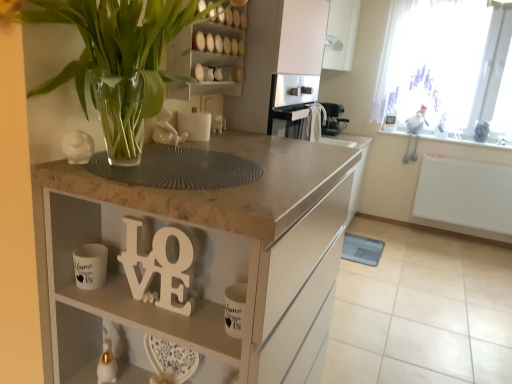
Question: Can you confirm if white matte cabinet at upper center is taller than clear glass vase at upper left?

Choices:
 (A) no
 (B) yes

Answer: (B)

Question: Is white matte cabinet at upper center oriented away from clear glass vase at upper left?

Choices:
 (A) yes
 (B) no

Answer: (B)

Question: Can you confirm if white matte cabinet at upper center is positioned to the right of clear glass vase at upper left?

Choices:
 (A) yes
 (B) no

Answer: (A)

Question: Is white matte cabinet at upper center shorter than clear glass vase at upper left?

Choices:
 (A) yes
 (B) no

Answer: (B)

Question: From a real-world perspective, is white matte cabinet at upper center below clear glass vase at upper left?

Choices:
 (A) yes
 (B) no

Answer: (B)

Question: Is the position of white matte cabinet at upper center more distant than that of clear glass vase at upper left?

Choices:
 (A) no
 (B) yes

Answer: (B)

Question: Does white matte wooden letters at center have a greater height compared to white sheer curtain at upper right?

Choices:
 (A) yes
 (B) no

Answer: (B)

Question: Is white matte wooden letters at center at the right side of white sheer curtain at upper right?

Choices:
 (A) yes
 (B) no

Answer: (B)

Question: Can we say white matte wooden letters at center lies outside white sheer curtain at upper right?

Choices:
 (A) no
 (B) yes

Answer: (B)

Question: Is white matte wooden letters at center bigger than white sheer curtain at upper right?

Choices:
 (A) yes
 (B) no

Answer: (B)

Question: Can you confirm if white matte wooden letters at center is thinner than white sheer curtain at upper right?

Choices:
 (A) no
 (B) yes

Answer: (B)

Question: Is white matte wooden letters at center positioned with its back to white sheer curtain at upper right?

Choices:
 (A) no
 (B) yes

Answer: (B)

Question: Is white glossy mug at lower left shorter than wooden shelves at upper center?

Choices:
 (A) yes
 (B) no

Answer: (A)